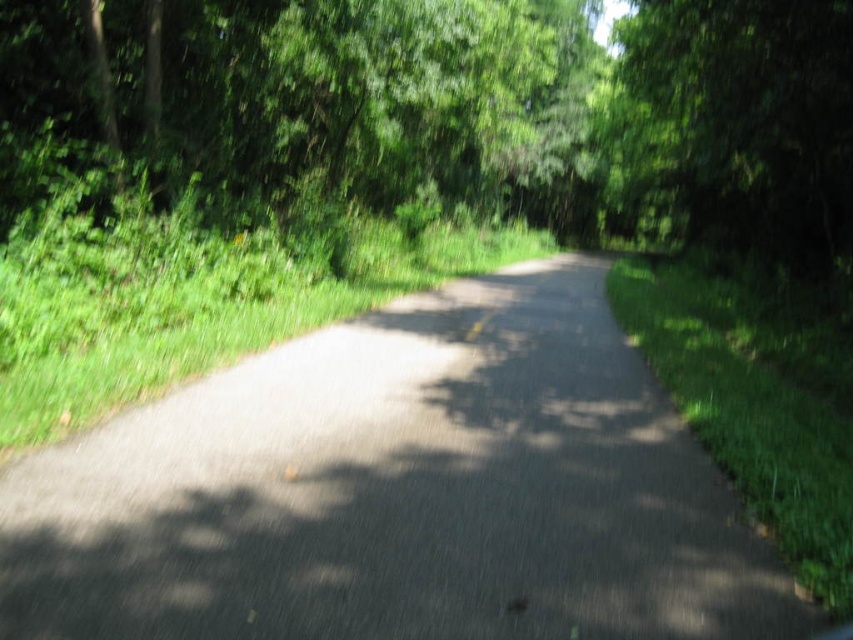
Question: Can you confirm if green leafy tree at center is wider than green leafy tree at upper right?

Choices:
 (A) yes
 (B) no

Answer: (A)

Question: Where is asphalt road at center located in relation to green leafy tree at center in the image?

Choices:
 (A) right
 (B) left

Answer: (B)

Question: Among these points, which one is nearest to the camera?

Choices:
 (A) (776, 131)
 (B) (424, 307)
 (C) (77, 45)

Answer: (C)

Question: Which object is the closest to the green leafy tree at center?

Choices:
 (A) asphalt road at center
 (B) green leafy tree at upper right

Answer: (B)

Question: Which is nearer to the green leafy tree at upper right?

Choices:
 (A) asphalt road at center
 (B) green leafy tree at center

Answer: (B)

Question: Can you confirm if asphalt road at center is thinner than green leafy tree at upper right?

Choices:
 (A) no
 (B) yes

Answer: (B)